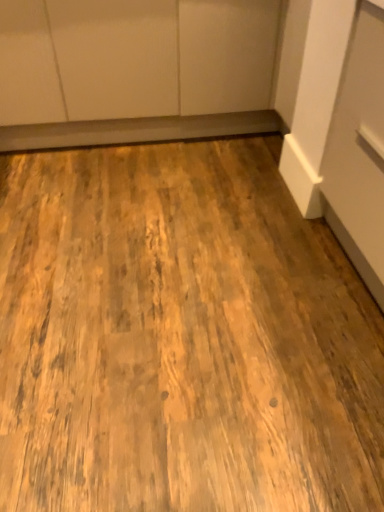
Question: From their relative heights in the image, would you say natural wood floor at center is taller or shorter than matte white cabinetry at upper center?

Choices:
 (A) short
 (B) tall

Answer: (A)

Question: Is natural wood floor at center spatially inside matte white cabinetry at upper center, or outside of it?

Choices:
 (A) inside
 (B) outside

Answer: (B)

Question: From the image's perspective, is natural wood floor at center located above or below matte white cabinetry at upper center?

Choices:
 (A) above
 (B) below

Answer: (B)

Question: From the image's perspective, relative to natural wood floor at center, is matte white cabinetry at upper center above or below?

Choices:
 (A) above
 (B) below

Answer: (A)

Question: Looking at their shapes, would you say matte white cabinetry at upper center is wider or thinner than natural wood floor at center?

Choices:
 (A) wide
 (B) thin

Answer: (B)

Question: Is point (264, 10) positioned closer to the camera than point (345, 384)?

Choices:
 (A) farther
 (B) closer

Answer: (A)

Question: Considering their positions, is matte white cabinetry at upper center located in front of or behind natural wood floor at center?

Choices:
 (A) front
 (B) behind

Answer: (B)